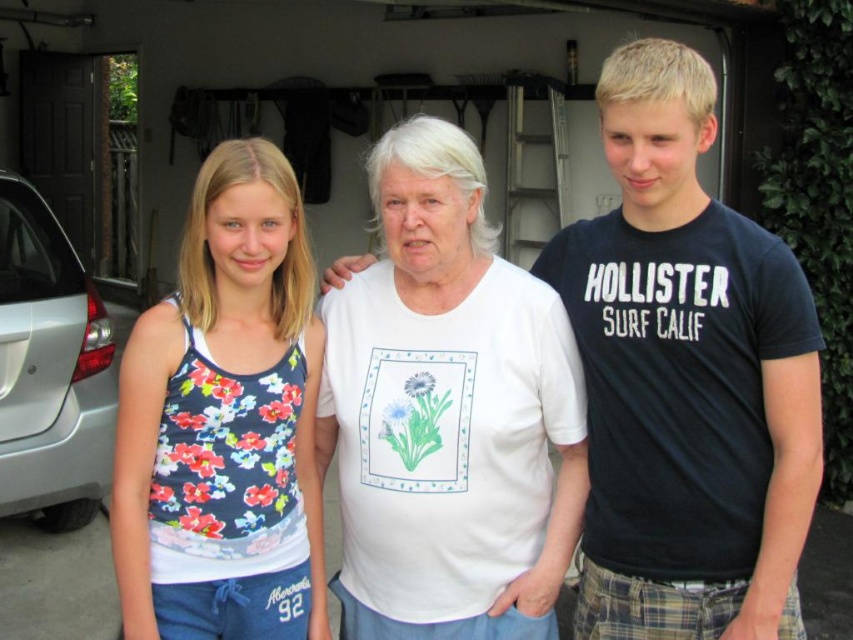
In the scene shown: Can you confirm if white cotton t-shirt at center is bigger than floral-patterned tank top at left?

Yes.

Is point (479, 278) positioned behind point (178, 625)?

Yes, it is behind point (178, 625).

Who is more forward, (374, 620) or (198, 550)?

Point (198, 550) is in front.

The height and width of the screenshot is (640, 853). In order to click on white cotton t-shirt at center in this screenshot , I will do `click(448, 412)`.

Based on the photo, does black cotton t-shirt at right have a lesser width compared to silver metallic car at left?

Yes, black cotton t-shirt at right is thinner than silver metallic car at left.

Between black cotton t-shirt at right and silver metallic car at left, which one is positioned higher?

black cotton t-shirt at right is higher up.

Image resolution: width=853 pixels, height=640 pixels. What are the coordinates of `black cotton t-shirt at right` in the screenshot? It's located at (686, 378).

In the scene shown: Does white cotton t-shirt at center come in front of silver metallic car at left?

Yes, white cotton t-shirt at center is in front of silver metallic car at left.

Does white cotton t-shirt at center have a smaller size compared to silver metallic car at left?

Yes.

Between point (440, 595) and point (7, 307), which one is positioned in front?

Point (440, 595) is in front.

Identify the location of white cotton t-shirt at center. (448, 412).